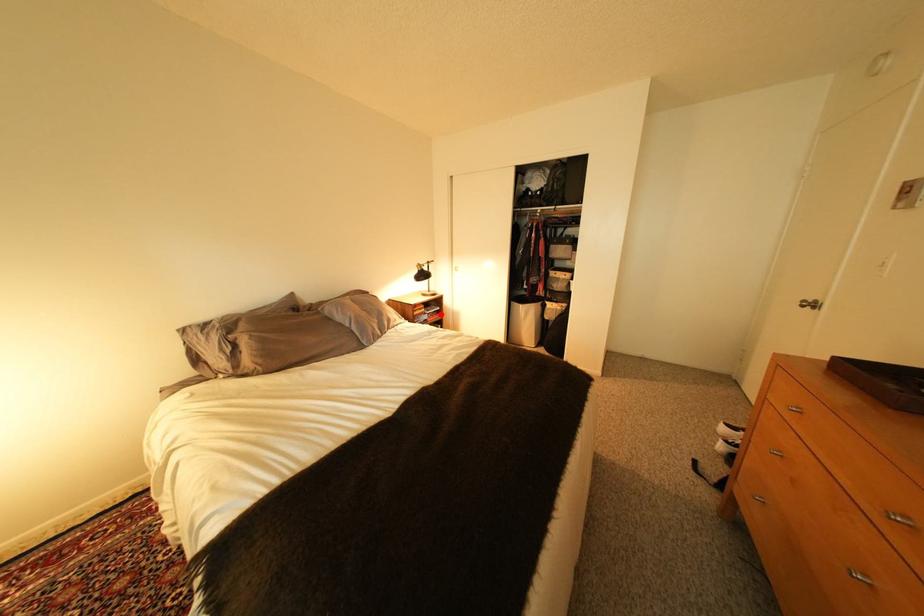
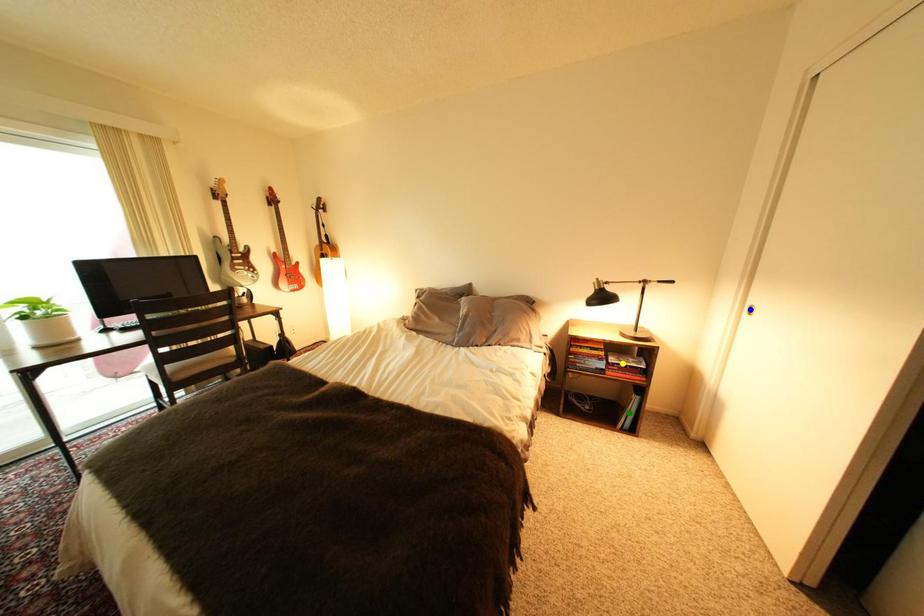
Question: I am providing you with two images of the same scene from different viewpoints. A red point is marked on the first image. You are given multiple points on the second image. In image 2, which mark is for the same physical point as the one in image 1?

Choices:
 (A) blue point
 (B) green point
 (C) yellow point

Answer: (C)